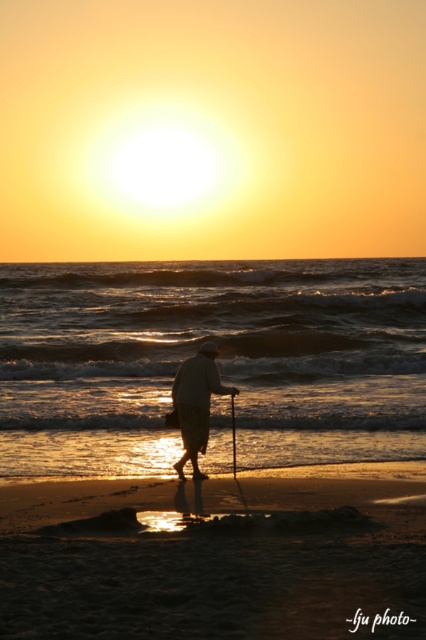
Does point (268, 634) come behind point (235, 388)?

That is False.

Who is higher up, sandy beach at lower center or white cloth at center?

Positioned higher is white cloth at center.

Describe the element at coordinates (216, 556) in the screenshot. I see `sandy beach at lower center` at that location.

This screenshot has width=426, height=640. Find the location of `sandy beach at lower center`. sandy beach at lower center is located at coordinates (216, 556).